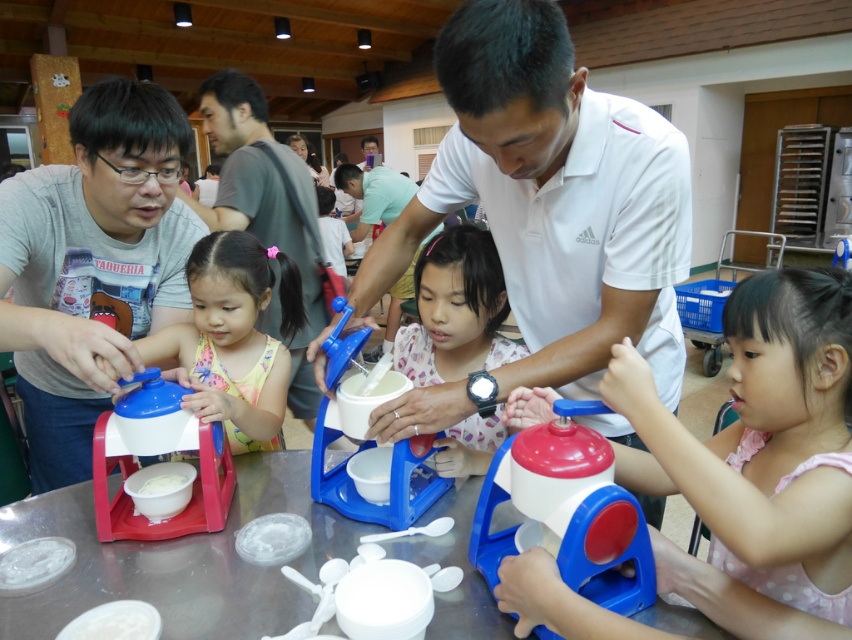
Question: Which object is farther from the camera taking this photo?

Choices:
 (A) matte plastic toy at lower right
 (B) matte plastic toy at left

Answer: (B)

Question: Is pink dotted dress at center in front of white matte shirt at upper center?

Choices:
 (A) yes
 (B) no

Answer: (A)

Question: Is white matte shirt at center closer to the viewer compared to white matte shirt at upper center?

Choices:
 (A) yes
 (B) no

Answer: (A)

Question: Estimate the real-world distances between objects in this image. Which object is farther from the white matte shirt at center?

Choices:
 (A) blue plastic toy at center
 (B) matte white shirt at center
 (C) smooth plastic table at center
 (D) matte plastic toy at left

Answer: (D)

Question: Does white matte shirt at center appear on the left side of white matte bowl at center?

Choices:
 (A) yes
 (B) no

Answer: (B)

Question: Which of the following is the farthest from the observer?

Choices:
 (A) matte plastic toy at lower right
 (B) pink dotted dress at center
 (C) matte gray shirt at center

Answer: (C)